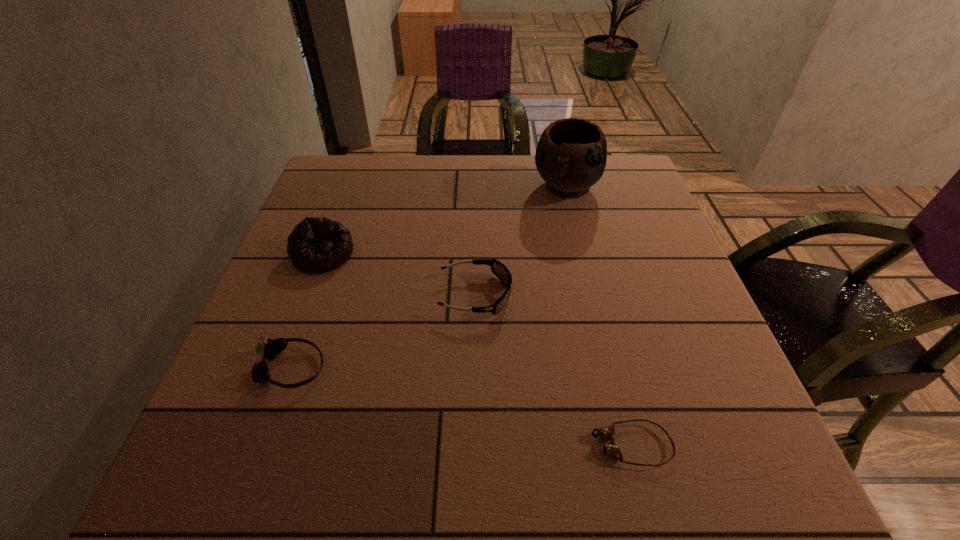
I want to click on pottery located in the right edge section of the desktop, so click(x=571, y=155).

Where is `goggles at the right edge`? The height and width of the screenshot is (540, 960). goggles at the right edge is located at coordinates (612, 449).

The image size is (960, 540). I want to click on object that is positioned at the far right corner, so click(x=571, y=155).

Locate an element on the screen. The width and height of the screenshot is (960, 540). object present at the near right corner is located at coordinates (612, 449).

This screenshot has width=960, height=540. Find the location of `free spot at the far edge of the desktop`. free spot at the far edge of the desktop is located at coordinates (460, 158).

Identify the location of vacant space at the right edge of the desktop. (x=721, y=408).

This screenshot has width=960, height=540. Identify the location of free space at the far left corner of the desktop. (329, 187).

Find the location of a particular element. blank space at the far right corner is located at coordinates (641, 191).

The image size is (960, 540). What are the coordinates of `vacant space at the near right corner` in the screenshot? It's located at pyautogui.click(x=683, y=441).

Find the location of a particular element. The height and width of the screenshot is (540, 960). empty location between the second farthest goggles and the second goggles from left to right is located at coordinates (383, 332).